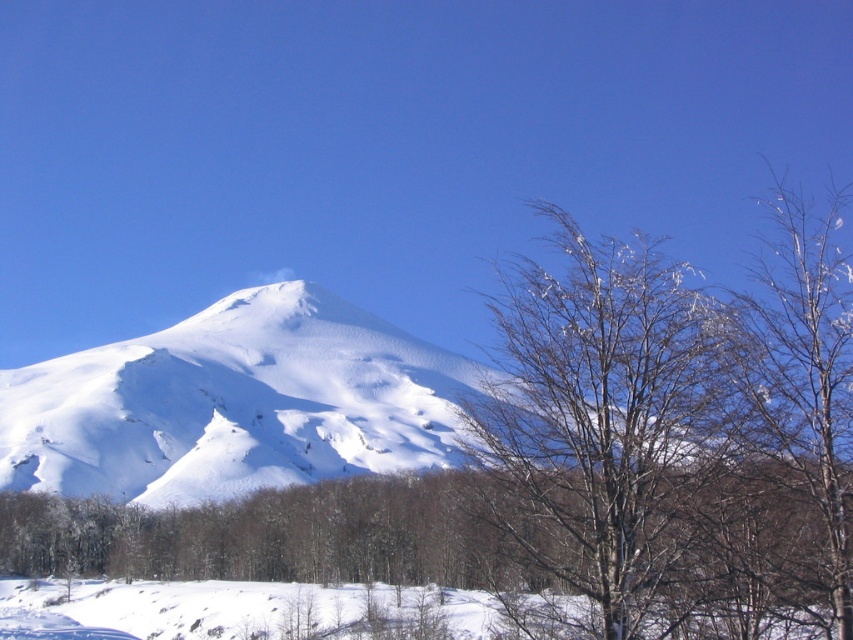
You are an artist trying to capture the winter scene. You notice the bare wood tree at center and the snowy bare branches at right. Which object has a narrower width?

The bare wood tree at center has a narrower width than the snowy bare branches at right.

You are standing at the base of the snow covered mountain and want to reach the point at coordinates point (674, 324). Given that you can walk 5 meters per minute, how long will it take you to reach that point?

The distance of point (674, 324) from viewer is 40.25 meters. At a walking speed of 5 meters per minute, it would take 8.05 minutes to reach the point.

You are standing at the base of the snow covered mountain and see a point marked at coordinates [608,429]. According to the image, what object is located at that point?

The point at coordinates [608,429] indicates a bare wood tree at center.